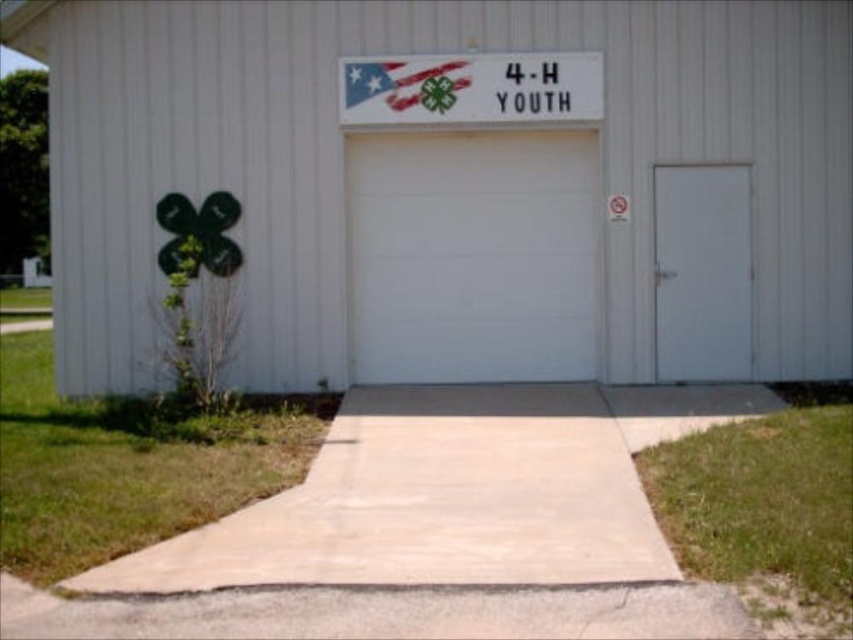
You are a delivery person trying to park your truck in front of the building. The truck requires a minimum clearance width of 2 meters. Given the white smooth garage door at center and the white plastic sign at upper center, can you determine if the garage door is wide enough for your truck?

The white smooth garage door at center is thinner than the white plastic sign at upper center. Since the sign is above the door, the door itself may not be wide enough for the truck requiring 2 meters clearance. However, without exact measurements, it is uncertain. Please check the actual dimensions before proceeding.

You are standing in front of the building and want to hang a new 1.5 foot wide banner between the white matte garage door at center and the white plastic sign at upper center. Can the banner fit horizontally between them?

The distance between the white matte garage door at center and the white plastic sign at upper center is 3.68 feet. Since the banner is 1.5 feet wide, it can fit horizontally between them as the space is wider than the banner.

Based on the photo, based on the scene description, can you determine the relative position of the white matte garage door at center and the white plastic sign at upper center?

The white matte garage door at center is to the left of the white plastic sign at upper center.